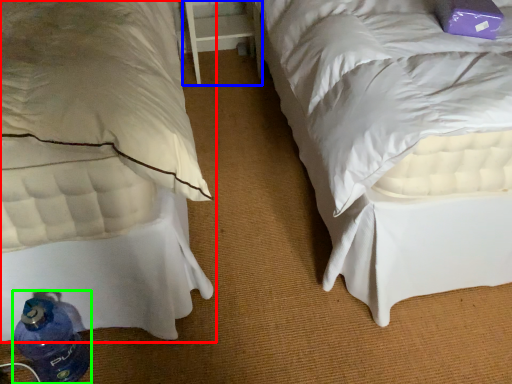
Question: Which is nearer to the bed (highlighted by a red box)? table (highlighted by a blue box) or bottle (highlighted by a green box).

Choices:
 (A) table
 (B) bottle

Answer: (B)